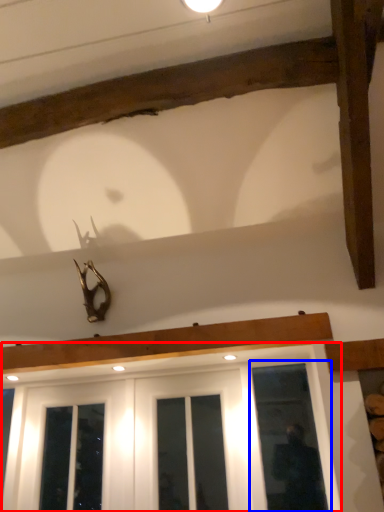
Question: Which of the following is the farthest to the observer, window (highlighted by a red box) or window (highlighted by a blue box)?

Choices:
 (A) window
 (B) window

Answer: (B)